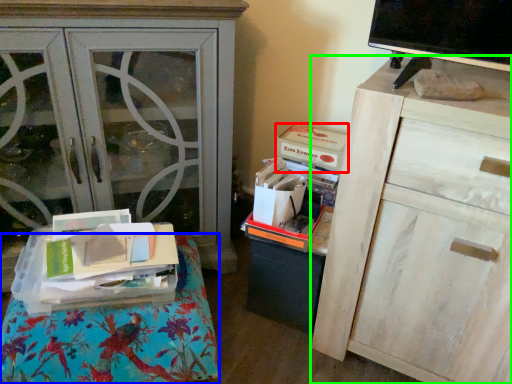
Question: Based on their relative distances, which object is nearer to storage box (highlighted by a red box)? Choose from furniture (highlighted by a blue box) and chest of drawers (highlighted by a green box).

Choices:
 (A) furniture
 (B) chest of drawers

Answer: (B)